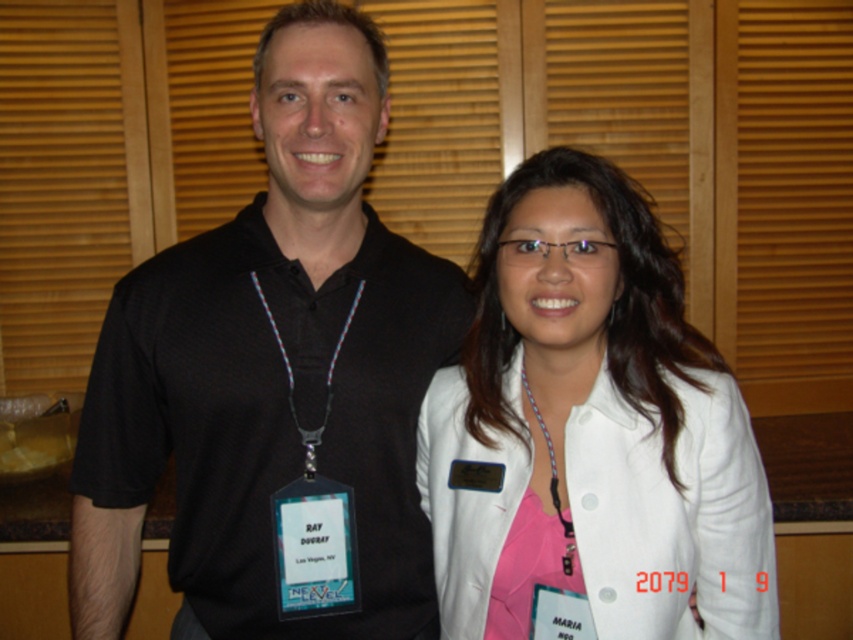
You are an event photographer and need to ensure that both the white matte jacket at center and the purple beaded necklace at center are clearly visible in the photo. Based on their positions, which one should you focus on first to capture both effectively?

Result: The white matte jacket at center is located above the purple beaded necklace at center. To capture both effectively, focus on the white matte jacket at center first as it is positioned higher, allowing the necklace to be in the lower part of the frame.

What is the significance of the point marked at coordinates (271, 369) in the image?

The point marked at coordinates (271, 369) indicates the location of the black mesh shirt at center in the image.